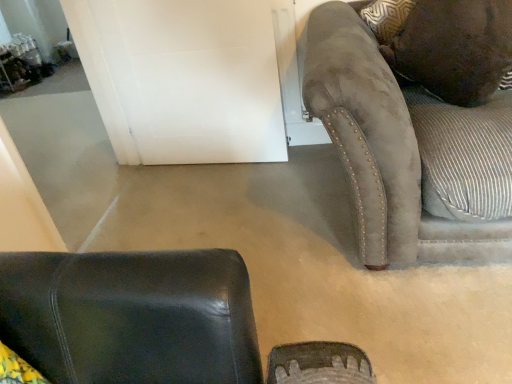
Locate an element on the screen. This screenshot has height=384, width=512. free spot to the right of white matte door at upper center is located at coordinates pyautogui.click(x=297, y=171).